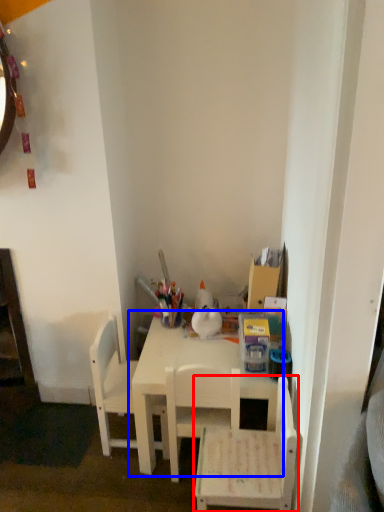
Question: Which of the following is the closest to the observer, chair (highlighted by a red box) or table (highlighted by a blue box)?

Choices:
 (A) chair
 (B) table

Answer: (A)